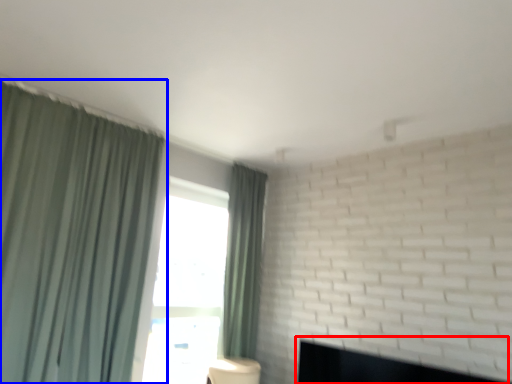
Question: Which of the following is the farthest to the observer, fireplace (highlighted by a red box) or curtain (highlighted by a blue box)?

Choices:
 (A) fireplace
 (B) curtain

Answer: (B)